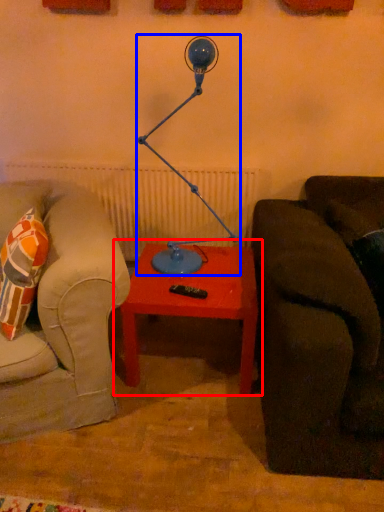
Question: Which object appears closest to the camera in this image, table (highlighted by a red box) or table lamp (highlighted by a blue box)?

Choices:
 (A) table
 (B) table lamp

Answer: (B)